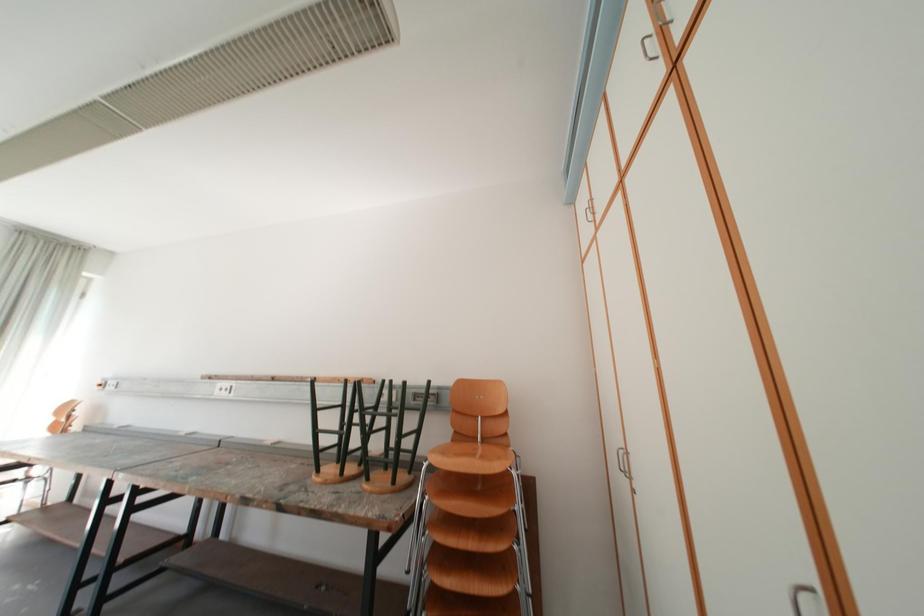
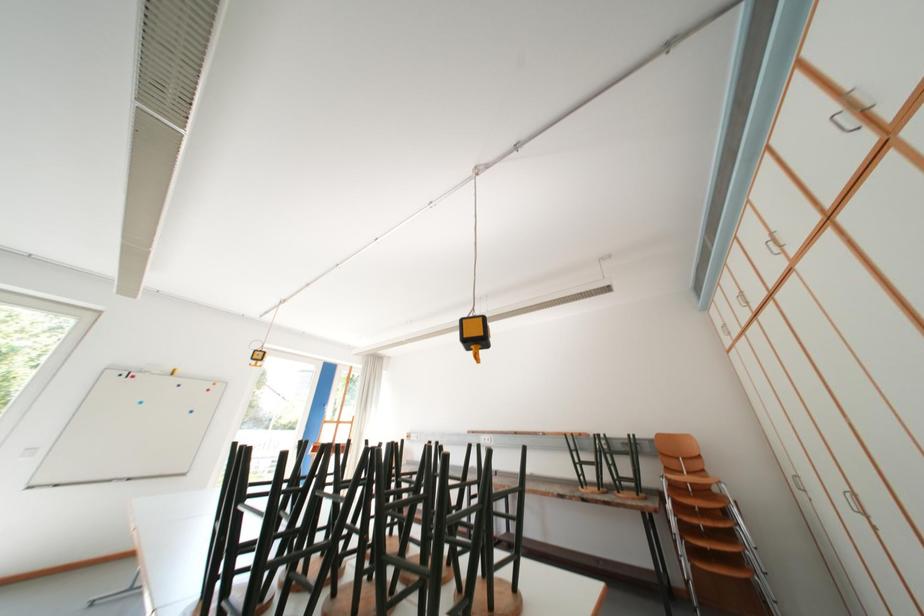
Which direction would the cameraman need to move to produce the second image?

The movement direction of the cameraman is left, backward.